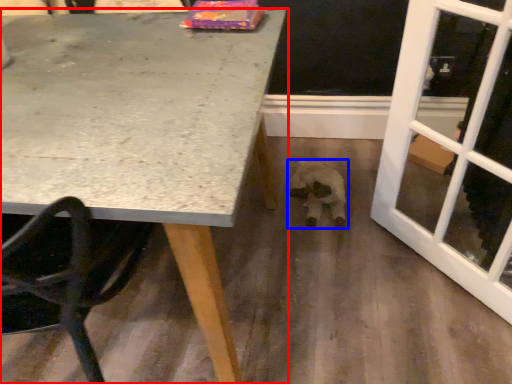
Question: Which point is closer to the camera, table (highlighted by a red box) or animal (highlighted by a blue box)?

Choices:
 (A) table
 (B) animal

Answer: (A)